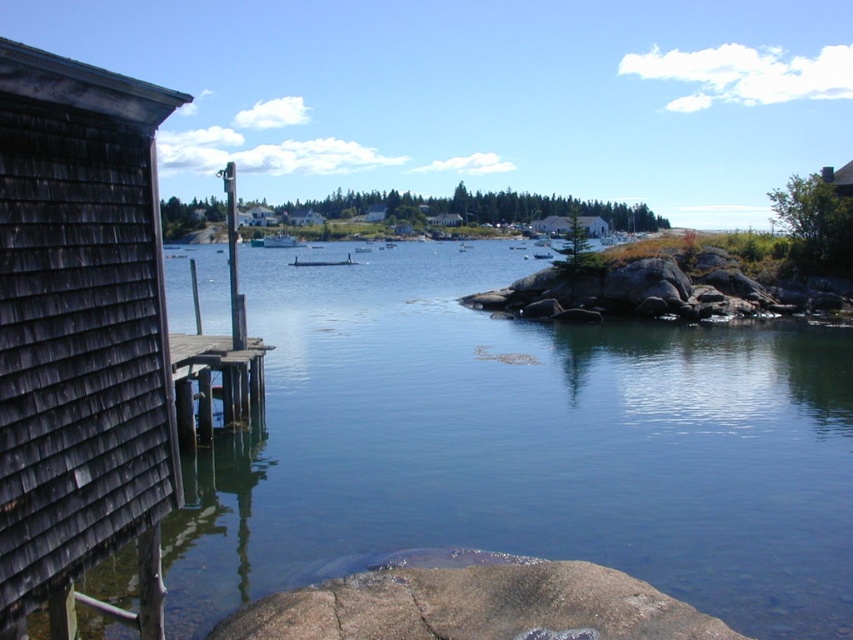
Question: Estimate the real-world distances between objects in this image. Which object is closer to the white wood house at center?

Choices:
 (A) gray rough rock at lower center
 (B) white shingled hut at center

Answer: (B)

Question: Observing the image, what is the correct spatial positioning of smooth water at center in reference to wooden planks at left?

Choices:
 (A) right
 (B) left

Answer: (A)

Question: Which of the following is the farthest from the observer?

Choices:
 (A) (15, 77)
 (B) (247, 209)
 (C) (438, 218)
 (D) (273, 236)

Answer: (B)

Question: Is green matte boat at center to the right of smooth white boat at center from the viewer's perspective?

Choices:
 (A) yes
 (B) no

Answer: (B)

Question: Is smooth white boat at center further to the viewer compared to white matte boat at center?

Choices:
 (A) no
 (B) yes

Answer: (A)

Question: Estimate the real-world distances between objects in this image. Which object is farther from the smooth water at center?

Choices:
 (A) smooth white boat at center
 (B) gray rough rock at lower center

Answer: (A)